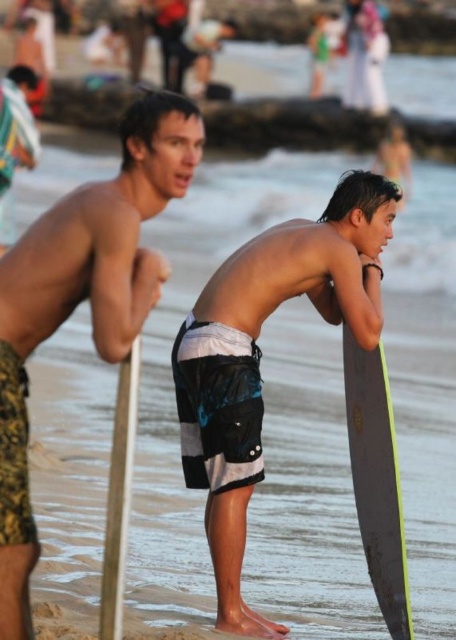
In the scene shown: You are a lifeguard standing at the wooden pole at lower left. You need to retrieve the matte black surfboard at right to check for safety issues. Can you reach it without leaving your post if your reach extends 1.5 meters?

The distance between the wooden pole at lower left and the matte black surfboard at right is 2.39 meters, which is beyond your 1.5 meter reach. You will need to leave your post to retrieve it.

You are a photographer trying to capture both the matte black surfboard at right and the wooden pole at lower left in a single shot. Based on their sizes, which object should you focus on first to ensure both fit in the frame?

The matte black surfboard at right is bigger than the wooden pole at lower left. To ensure both fit in the frame, focus on positioning the larger matte black surfboard at right first, then adjust the angle to include the smaller wooden pole at lower left.

You are a photographer trying to capture the black matte surfboard at center. You notice a point at coordinates (259, 356). Where is this point located in relation to the black matte surfboard at center?

The point at coordinates (259, 356) is located on the black matte surfboard at center.